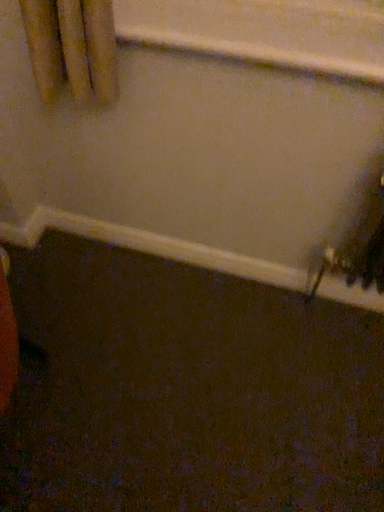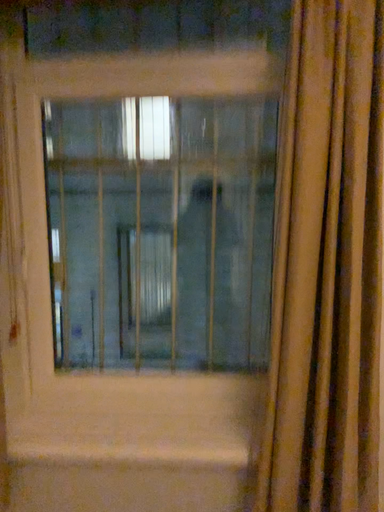
Question: Which way did the camera rotate in the video?

Choices:
 (A) rotated right
 (B) rotated left

Answer: (A)